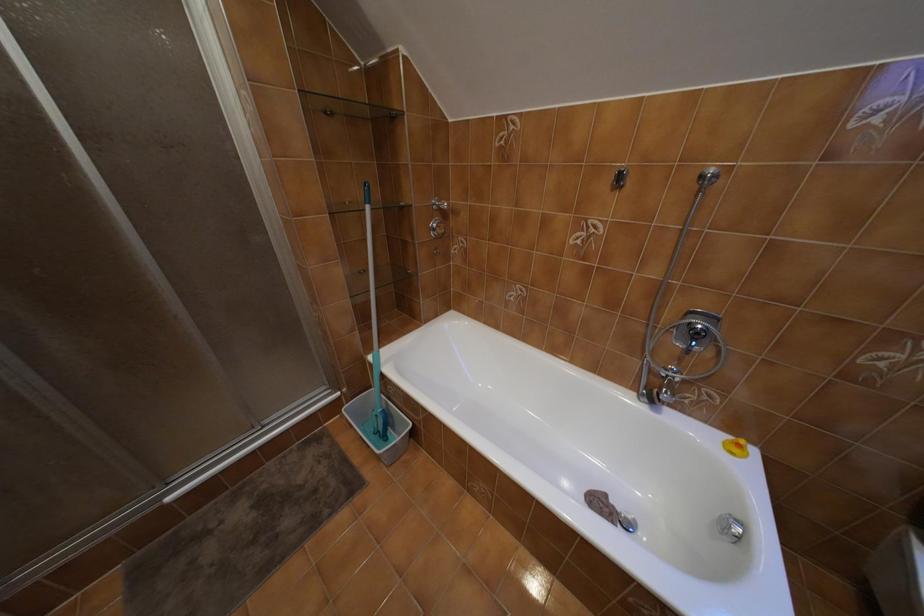
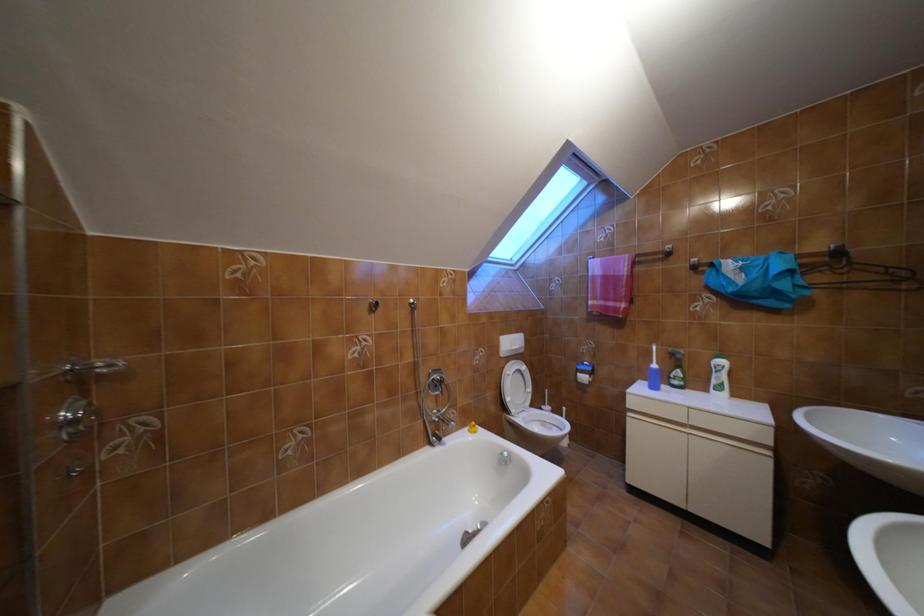
Question: How did the camera likely rotate?

Choices:
 (A) Left
 (B) Right
 (C) Up
 (D) Down

Answer: (B)